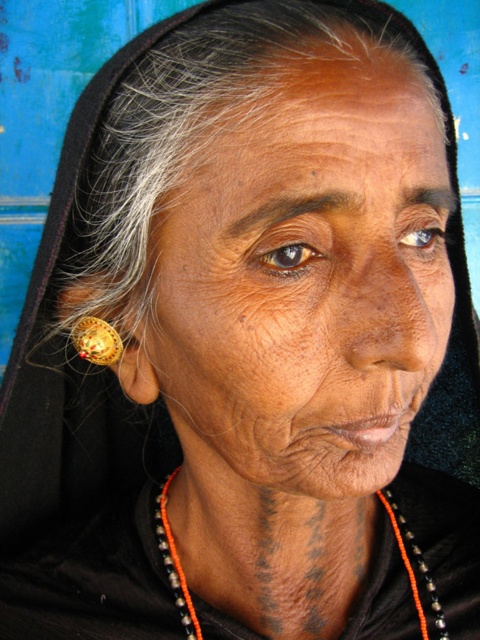
Which of these two, dry skin at center or gold metallic earring at left, stands taller?

With more height is dry skin at center.

Does dry skin at center have a smaller size compared to gold metallic earring at left?

No.

Who is more forward, (193, 248) or (92, 326)?

Point (193, 248) is in front.

Identify the location of dry skin at center. The height and width of the screenshot is (640, 480). (303, 289).

Does orange beaded necklace at lower center appear on the left side of gold metallic earring at left?

In fact, orange beaded necklace at lower center is to the right of gold metallic earring at left.

Is orange beaded necklace at lower center positioned behind gold metallic earring at left?

Yes, it is.

What do you see at coordinates (414, 564) in the screenshot? This screenshot has height=640, width=480. I see `orange beaded necklace at lower center` at bounding box center [414, 564].

This screenshot has width=480, height=640. Find the location of `orange beaded necklace at lower center`. orange beaded necklace at lower center is located at coordinates (414, 564).

In the scene shown: Which is above, dry skin at center or orange beaded necklace at lower center?

dry skin at center

Does dry skin at center appear over orange beaded necklace at lower center?

Yes, dry skin at center is above orange beaded necklace at lower center.

Find the location of a particular element. dry skin at center is located at coordinates (303, 289).